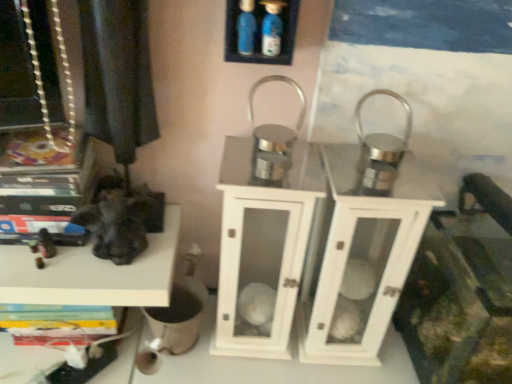
Question: Do you think white glossy lantern at center is within black matte statue at left, which ranks as the second shelf in top-to-bottom order, or outside of it?

Choices:
 (A) outside
 (B) inside

Answer: (A)

Question: From the image's perspective, is white glossy lantern at center positioned above or below black matte statue at left, which is the first shelf from bottom to top?

Choices:
 (A) below
 (B) above

Answer: (B)

Question: Estimate the real-world distances between objects in this image. Which object is farther from the black matte statue at left, the second shelf in the right-to-left sequence?

Choices:
 (A) white glossy lantern at center
 (B) blue plastic bottles at upper center, marked as the 1th shelf in a front-to-back arrangement

Answer: (B)

Question: Which object is the closest to the black matte statue at left, which ranks as the second shelf in front-to-back order?

Choices:
 (A) blue plastic bottles at upper center, acting as the 2th shelf starting from the left
 (B) white glossy lantern at center

Answer: (B)